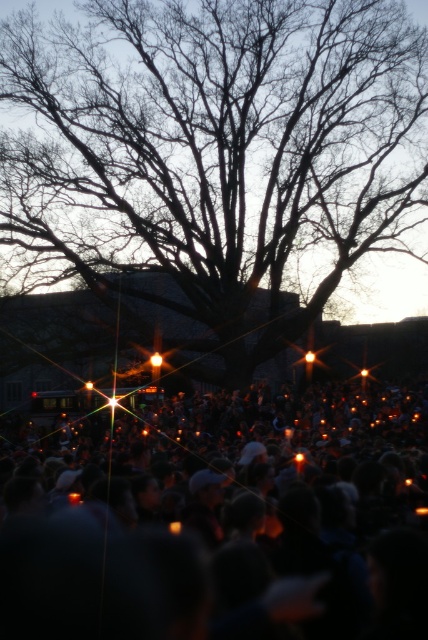
Which is below, silhouette bare branches at center or orange candle at lower center?

orange candle at lower center

This screenshot has width=428, height=640. Identify the location of silhouette bare branches at center. (213, 148).

Locate an element on the screen. This screenshot has height=640, width=428. silhouette bare branches at center is located at coordinates (213, 148).